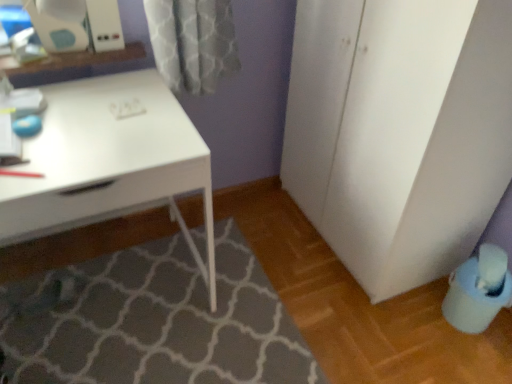
Identify the location of vacant space to the right of white glossy desk at upper left. (234, 312).